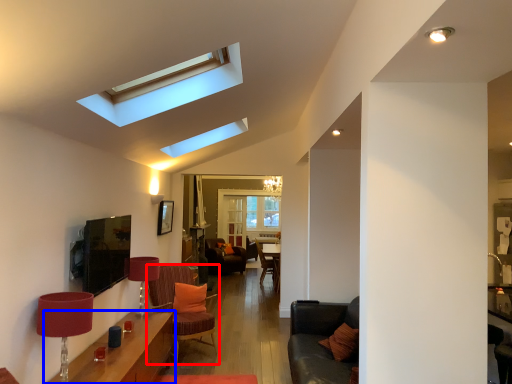
Question: Which point is further to the camera, chair (highlighted by a red box) or table (highlighted by a blue box)?

Choices:
 (A) chair
 (B) table

Answer: (A)